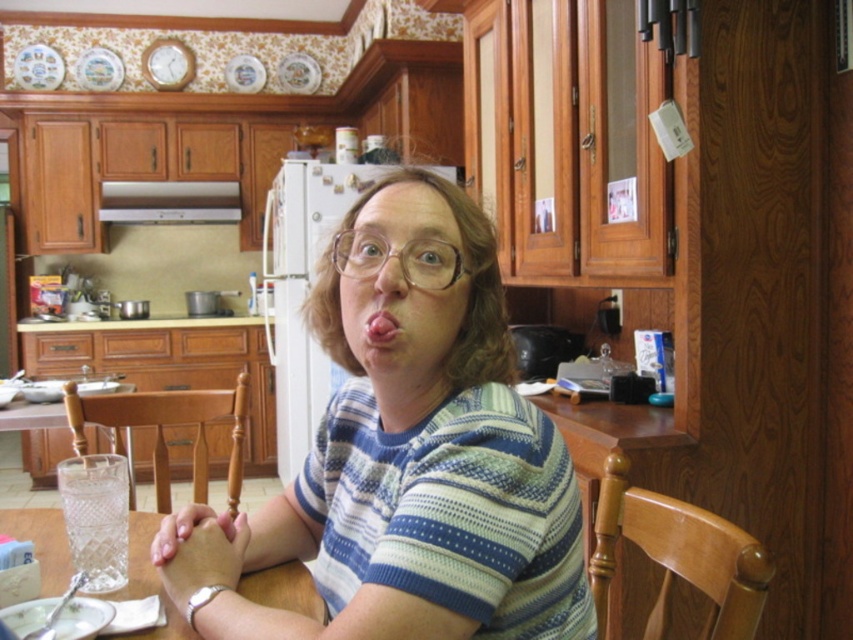
Question: Can you confirm if clear glass table at center is positioned to the left of pink flesh at center?

Choices:
 (A) no
 (B) yes

Answer: (B)

Question: Among these points, which one is farthest from the camera?

Choices:
 (A) (453, 570)
 (B) (399, 332)

Answer: (B)

Question: Is clear glass table at center above pink flesh at center?

Choices:
 (A) no
 (B) yes

Answer: (A)

Question: Does striped cotton shirt at center appear under clear glass table at center?

Choices:
 (A) no
 (B) yes

Answer: (A)

Question: Which is farther from the pink flesh at center?

Choices:
 (A) striped cotton shirt at center
 (B) clear glass table at center

Answer: (B)

Question: Among these objects, which one is nearest to the camera?

Choices:
 (A) clear glass table at center
 (B) pink flesh at center
 (C) striped cotton shirt at center

Answer: (C)